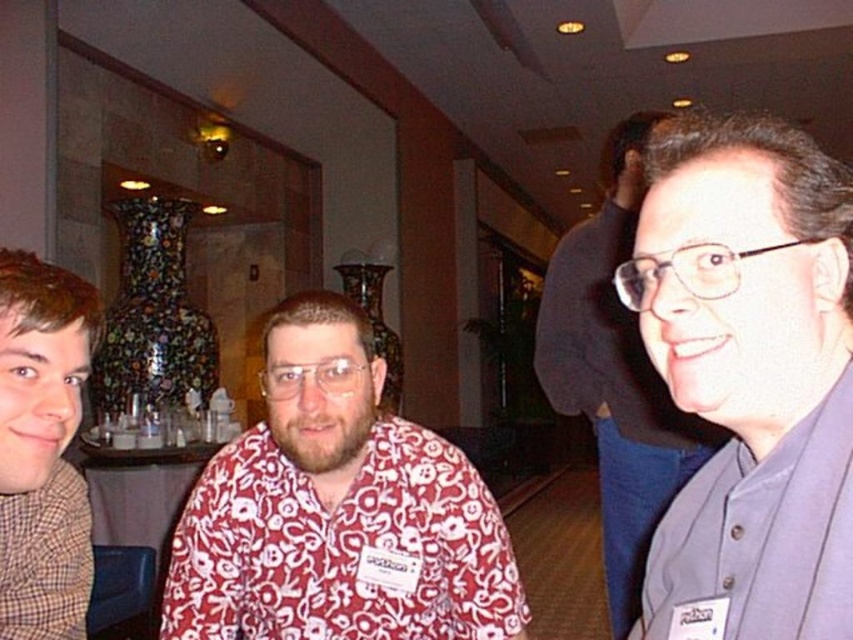
Is blue cotton shirt at right closer to camera compared to gray fabric shirt at right?

That is True.

Describe the element at coordinates (759, 540) in the screenshot. I see `blue cotton shirt at right` at that location.

Find the location of a particular element. The height and width of the screenshot is (640, 853). blue cotton shirt at right is located at coordinates (759, 540).

Where is `blue cotton shirt at right`? The width and height of the screenshot is (853, 640). blue cotton shirt at right is located at coordinates (759, 540).

Between floral-patterned shirt at center and blue cotton shirt at right, which one is positioned lower?

floral-patterned shirt at center is below.

Who is more forward, (x=334, y=333) or (x=734, y=513)?

Point (x=734, y=513) is in front.

The width and height of the screenshot is (853, 640). What do you see at coordinates (337, 509) in the screenshot?
I see `floral-patterned shirt at center` at bounding box center [337, 509].

Locate an element on the screen. The width and height of the screenshot is (853, 640). floral-patterned shirt at center is located at coordinates (337, 509).

Is floral-patterned shirt at center further to camera compared to gray fabric shirt at right?

No, it is in front of gray fabric shirt at right.

Looking at this image, can you confirm if floral-patterned shirt at center is positioned to the right of gray fabric shirt at right?

No, floral-patterned shirt at center is not to the right of gray fabric shirt at right.

This screenshot has height=640, width=853. What do you see at coordinates (337, 509) in the screenshot?
I see `floral-patterned shirt at center` at bounding box center [337, 509].

At what (x,y) coordinates should I click in order to perform the action: click on floral-patterned shirt at center. Please return your answer as a coordinate pair (x, y). Looking at the image, I should click on (337, 509).